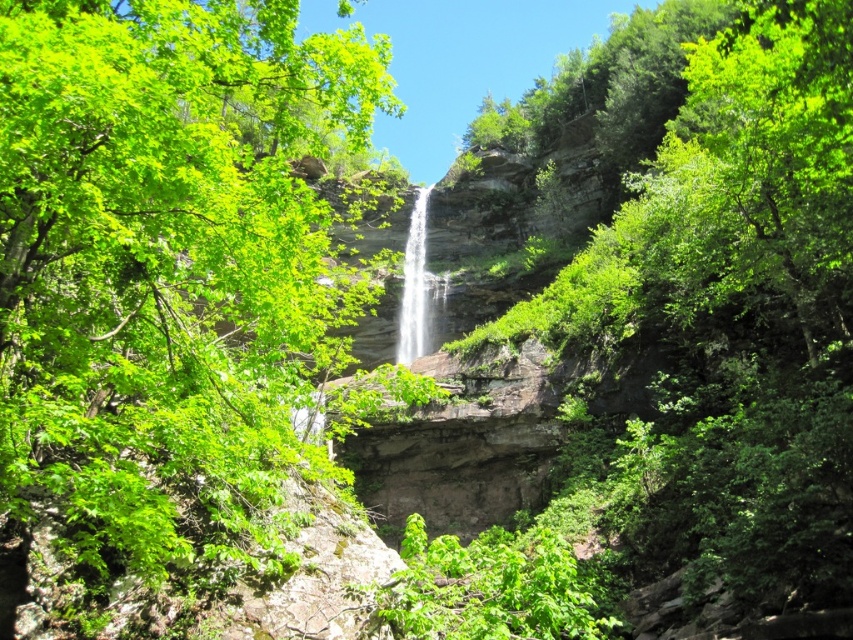
You are a hiker standing at the base of the white smooth waterfall at center and want to reach the green leafy tree at center. Is the tree located above or below the waterfall?

The green leafy tree at center is positioned under the white smooth waterfall at center, so the tree is located below the waterfall.

You are standing at the edge of the cliff overlooking the green leafy tree at center and the white smooth waterfall at center. Which object is located to the left when facing the waterfall?

The green leafy tree at center is positioned on the left side of the white smooth waterfall at center, so when facing the waterfall, the green leafy tree at center is to the left.

You are standing in front of the waterfall and want to take a photo of both the green leafy tree at center and the white smooth waterfall at center. Which object should you focus on first to ensure both are in sharp focus?

You should focus on the green leafy tree at center first because it is closer to the viewer than the white smooth waterfall at center, so adjusting focus from near to far will help both be in sharp focus.